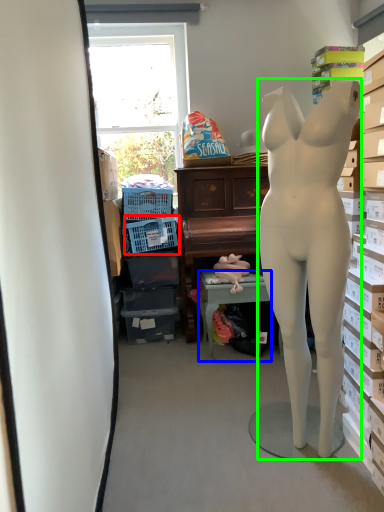
Question: Which is farther away from laundry basket (highlighted by a red box)? table (highlighted by a blue box) or person (highlighted by a green box)?

Choices:
 (A) table
 (B) person

Answer: (B)